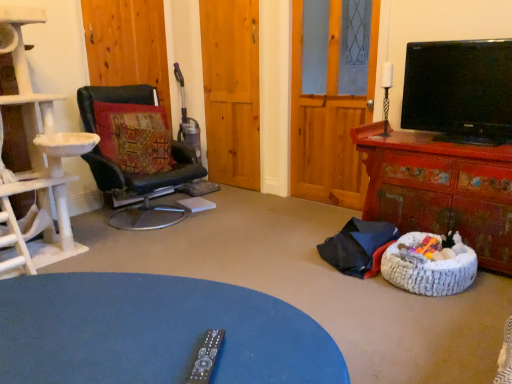
Where is `blank space to the left of black plastic remote at center`? blank space to the left of black plastic remote at center is located at coordinates (144, 354).